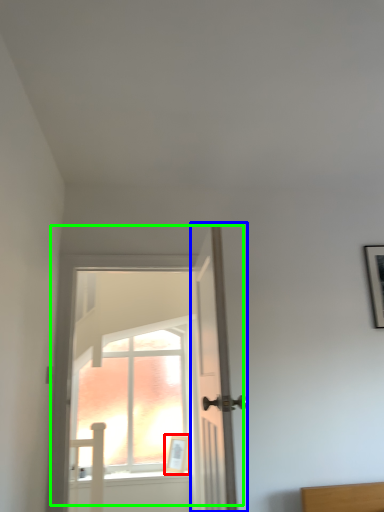
Question: Which is farther away from picture frame (highlighted by a red box)? door (highlighted by a blue box) or door (highlighted by a green box)?

Choices:
 (A) door
 (B) door

Answer: (A)